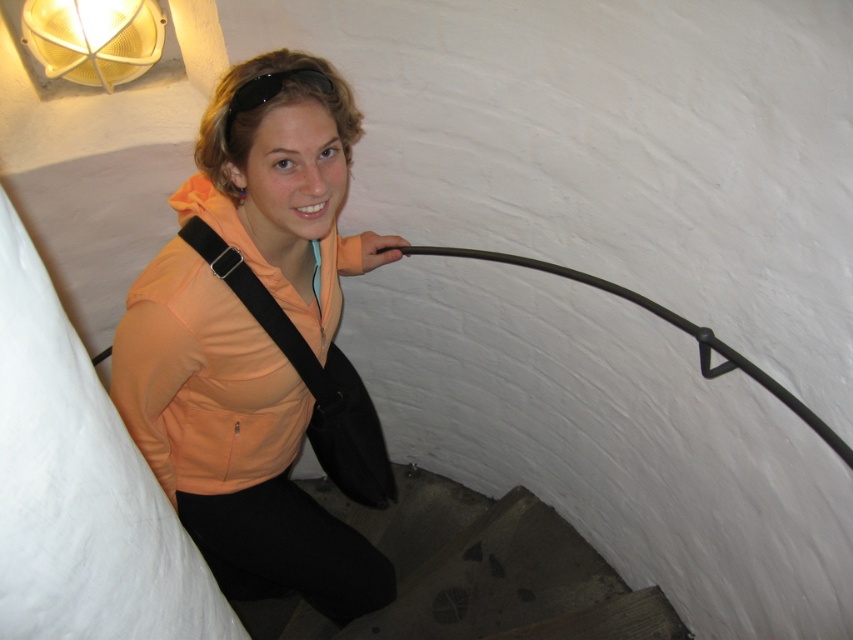
Question: Does orange fabric jacket at center appear on the left side of matte yellow mesh at upper left?

Choices:
 (A) no
 (B) yes

Answer: (A)

Question: Is orange fabric jacket at center wider than matte yellow mesh at upper left?

Choices:
 (A) no
 (B) yes

Answer: (B)

Question: Is orange fabric jacket at center above dark brown wooden stairs at lower center?

Choices:
 (A) yes
 (B) no

Answer: (A)

Question: Among these objects, which one is farthest from the camera?

Choices:
 (A) dark brown wooden stairs at lower center
 (B) orange fabric jacket at center
 (C) matte yellow mesh at upper left

Answer: (A)

Question: Among these objects, which one is farthest from the camera?

Choices:
 (A) dark brown wooden stairs at lower center
 (B) matte yellow mesh at upper left

Answer: (A)

Question: Which point is farther to the camera?

Choices:
 (A) orange fabric jacket at center
 (B) matte yellow mesh at upper left
 (C) dark brown wooden stairs at lower center

Answer: (C)